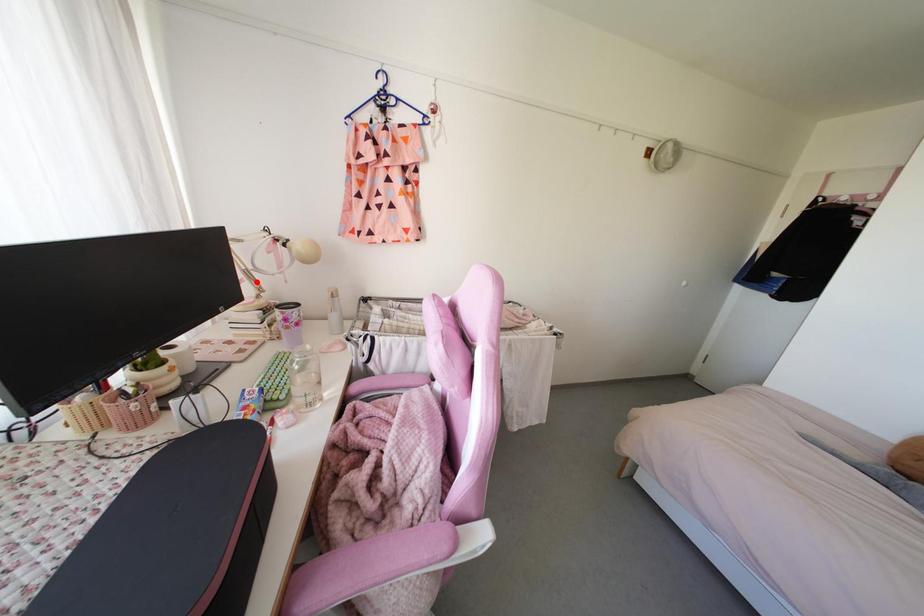
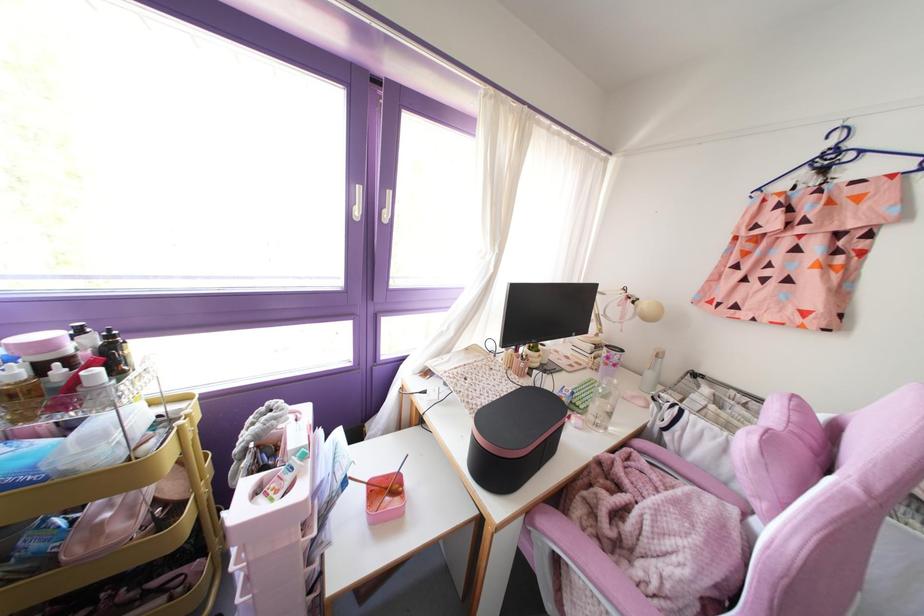
Locate, in the second image, the point that corresponds to the highlighted location in the first image.

(600, 325)